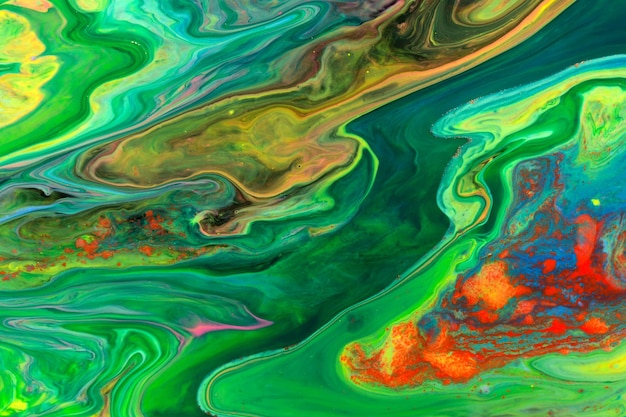
Where is `painting`? This screenshot has height=417, width=626. painting is located at coordinates (354, 246).